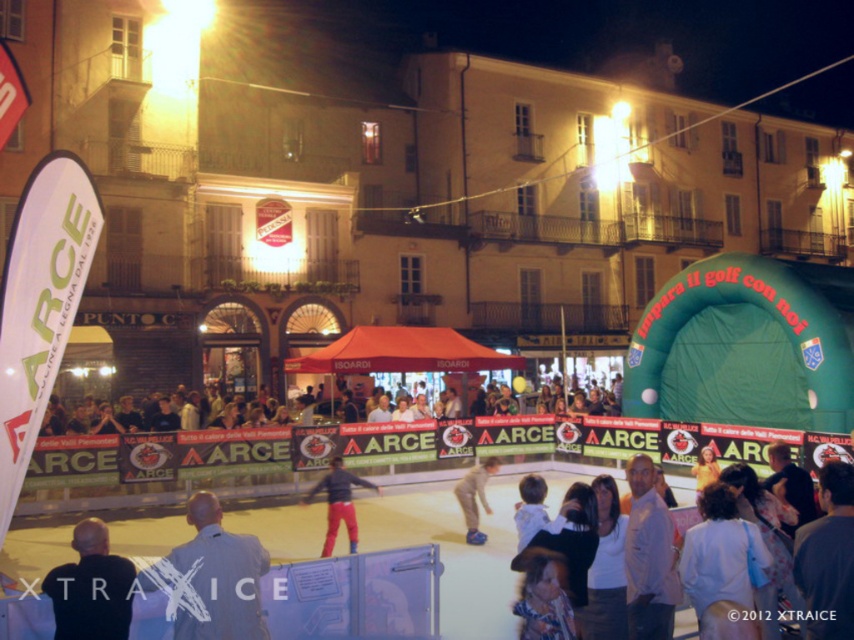
You are a photographer at the event and want to capture both the light gray shirt at center and the red pants at center in a single shot. Which subject should you focus on to ensure both are in frame without cropping?

You should focus on the light gray shirt at center since it is wider than the red pants at center, ensuring both subjects fit within the frame.

You are at the skating rink and want to locate the light gray shirt at center and the light gray jacket at lower left. From the perspective of someone standing at the center of the rink, which object is positioned to the left?

The light gray shirt at center is to the left of the light gray jacket at lower left, so from the center of the rink, the light gray shirt at center would be on the left side.

You are at the skating rink and want to find someone wearing a light gray shirt at center. Where should you look relative to the light gray jacket at lower left?

The light gray shirt at center is located below the light gray jacket at lower left, so you should look downward from the light gray jacket at lower left to find the light gray shirt at center.